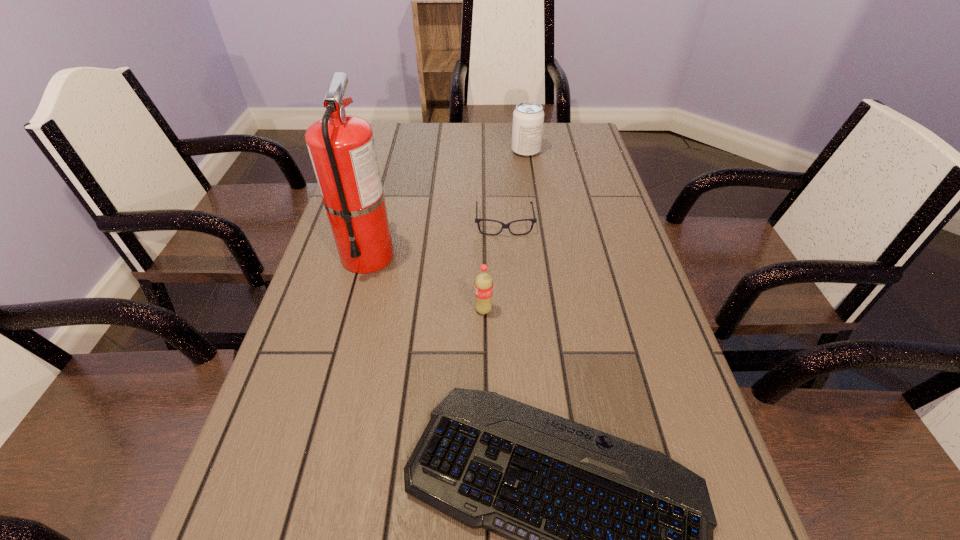
Find the location of a particular element. This screenshot has height=540, width=960. empty space that is in between the leftmost object and the right soda is located at coordinates (446, 203).

Find the location of a particular element. This screenshot has height=540, width=960. blank region between the leftmost object and the right soda is located at coordinates click(446, 203).

You are a GUI agent. You are given a task and a screenshot of the screen. Output one action in this format:
    pyautogui.click(x=<x>, y=<y>)
    Task: Click on the vacant area between the spectacles and the leftmost object
    
    Given the screenshot: What is the action you would take?
    pyautogui.click(x=436, y=239)

Locate which object ranks fourth in proximity to the second shortest object. Please provide its 2D coordinates. Your answer should be formatted as a tuple, i.e. [(x, y)], where the tuple contains the x and y coordinates of a point satisfying the conditions above.

[(607, 539)]

Find the location of `object that is the closest to the right soda`. object that is the closest to the right soda is located at coordinates (477, 220).

Find the location of a particular element. vacant space that satisfies the following two spatial constraints: 1. at the nozzle of the fire extinguisher; 2. on the right side of the nearer soda is located at coordinates (353, 310).